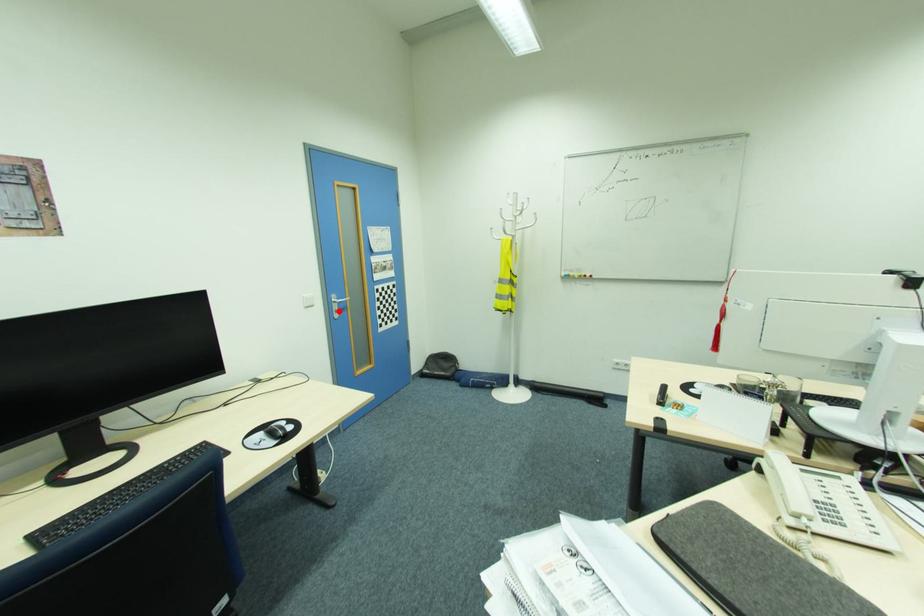
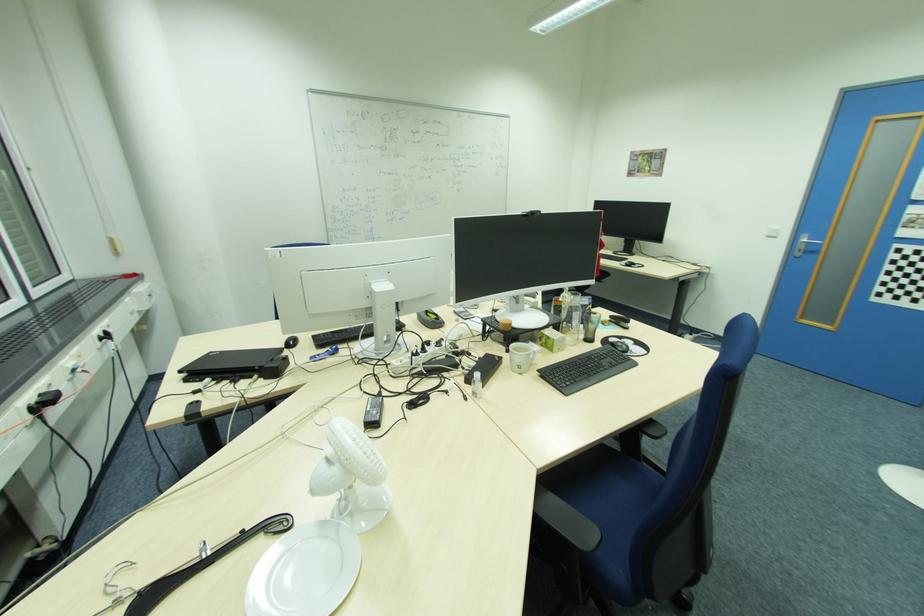
Where in the second image is the point corresponding to the highlighted location from the first image?

(804, 251)